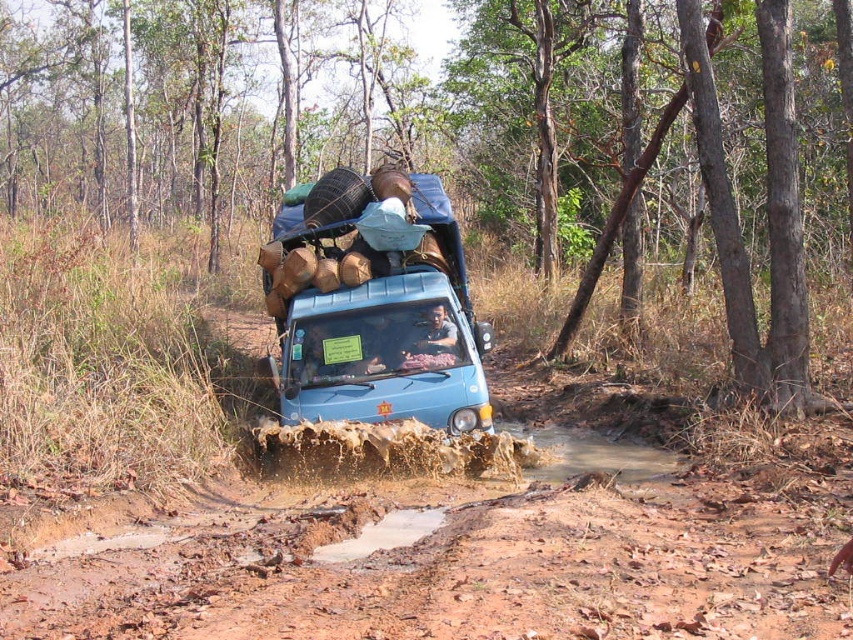
Can you confirm if brown muddy dirt track at center is shorter than blue matte truck at center?

Indeed, brown muddy dirt track at center has a lesser height compared to blue matte truck at center.

Does point (682, 632) come behind point (305, 332)?

No, it is not.

The width and height of the screenshot is (853, 640). In order to click on brown muddy dirt track at center in this screenshot , I will do `click(473, 568)`.